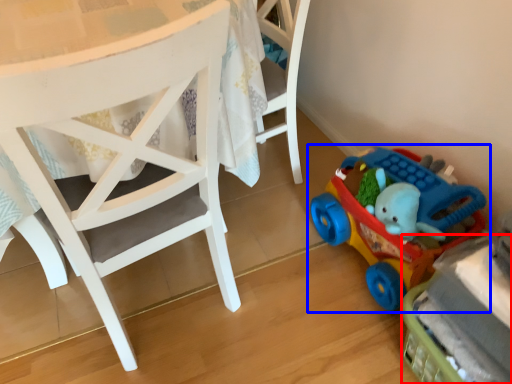
Question: Which object appears farthest to the camera in this image, toy (highlighted by a red box) or toy (highlighted by a blue box)?

Choices:
 (A) toy
 (B) toy

Answer: (B)